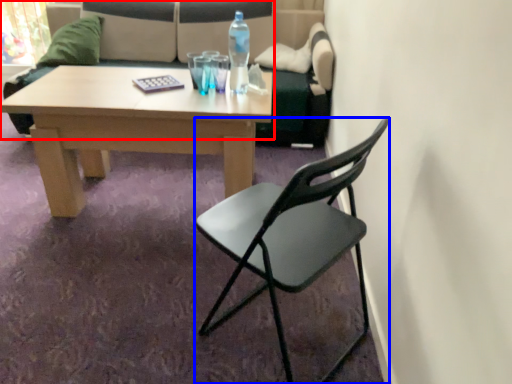
Question: Which object appears closest to the camera in this image, studio couch (highlighted by a red box) or chair (highlighted by a blue box)?

Choices:
 (A) studio couch
 (B) chair

Answer: (B)